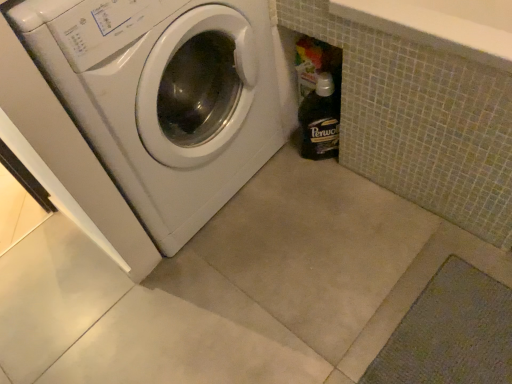
Question: Is white glossy washing machine at left directly adjacent to black glass bottle at lower right?

Choices:
 (A) no
 (B) yes

Answer: (A)

Question: Considering the relative sizes of white glossy washing machine at left and black glass bottle at lower right in the image provided, is white glossy washing machine at left bigger than black glass bottle at lower right?

Choices:
 (A) yes
 (B) no

Answer: (A)

Question: Is white glossy washing machine at left thinner than black glass bottle at lower right?

Choices:
 (A) no
 (B) yes

Answer: (A)

Question: From the image's perspective, is white glossy washing machine at left below black glass bottle at lower right?

Choices:
 (A) no
 (B) yes

Answer: (A)

Question: From the image's perspective, is white glossy washing machine at left located above black glass bottle at lower right?

Choices:
 (A) yes
 (B) no

Answer: (A)

Question: Does white glossy washing machine at left lie behind black glass bottle at lower right?

Choices:
 (A) yes
 (B) no

Answer: (B)

Question: Is black glass bottle at lower right positioned far away from white glossy washing machine at left?

Choices:
 (A) no
 (B) yes

Answer: (A)

Question: From the image's perspective, would you say black glass bottle at lower right is positioned over white glossy washing machine at left?

Choices:
 (A) yes
 (B) no

Answer: (B)

Question: Is black glass bottle at lower right oriented towards white glossy washing machine at left?

Choices:
 (A) no
 (B) yes

Answer: (A)

Question: Does black glass bottle at lower right lie behind white glossy washing machine at left?

Choices:
 (A) yes
 (B) no

Answer: (A)

Question: Is white glossy washing machine at left surrounded by black glass bottle at lower right?

Choices:
 (A) no
 (B) yes

Answer: (A)

Question: Does black glass bottle at lower right appear on the left side of white glossy washing machine at left?

Choices:
 (A) yes
 (B) no

Answer: (B)

Question: In the image, is black glass bottle at lower right positioned in front of or behind white glossy washing machine at left?

Choices:
 (A) front
 (B) behind

Answer: (B)